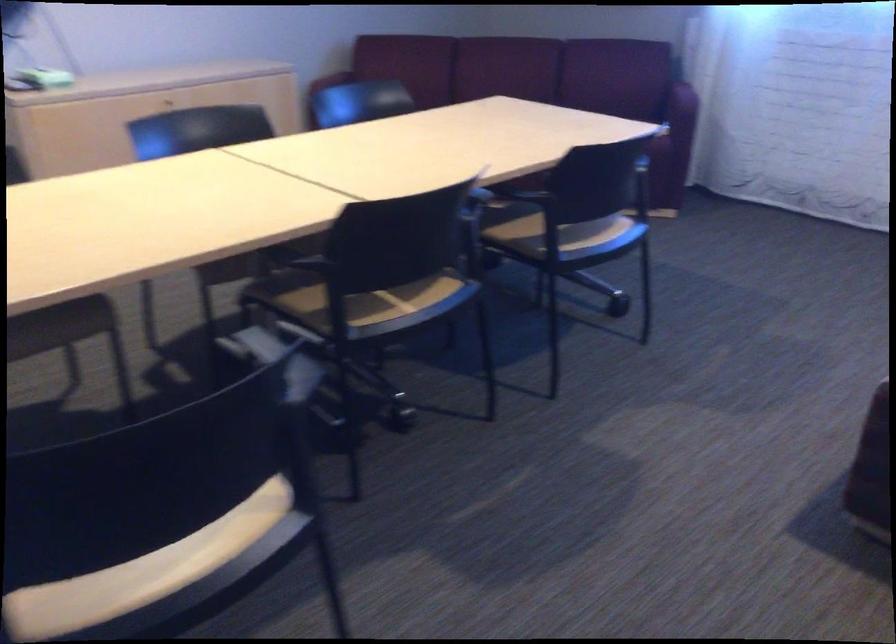
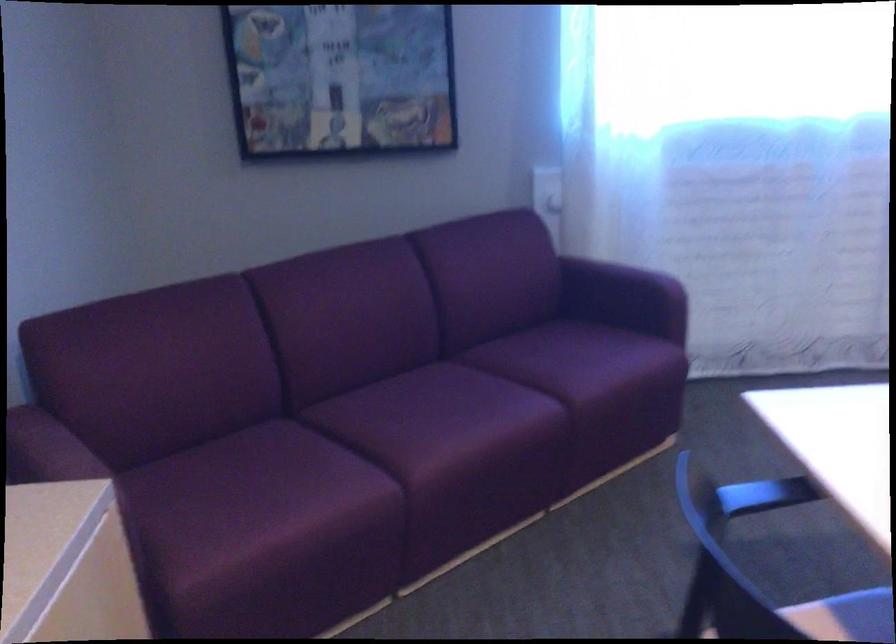
In the second image, find the point that corresponds to (298,71) in the first image.

(33, 446)